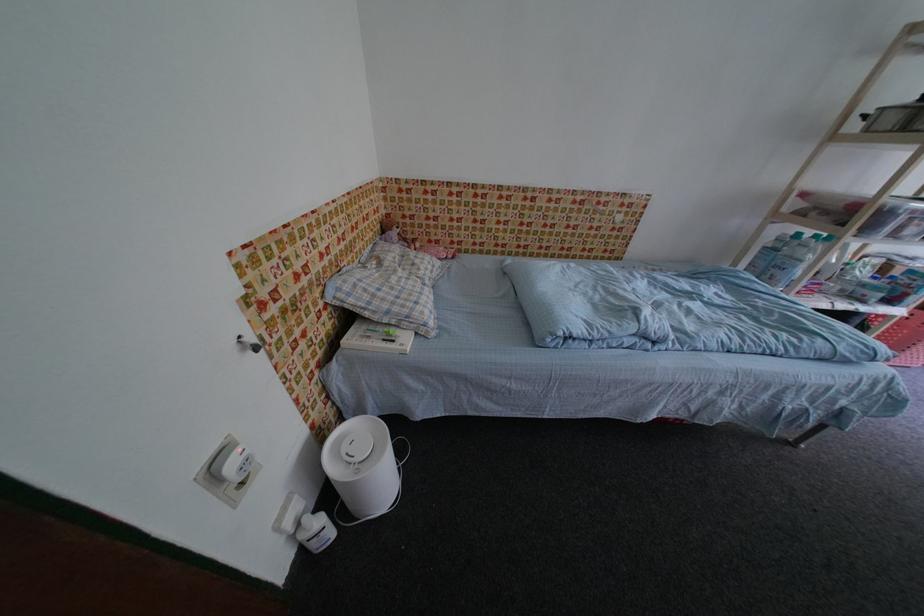
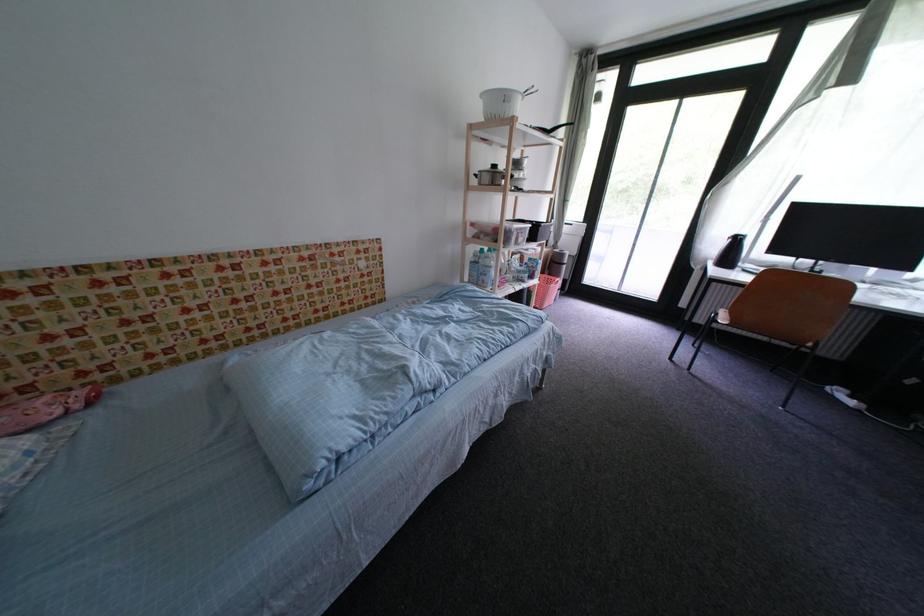
The point at (816, 237) is marked in the first image. Where is the corresponding point in the second image?

(493, 252)